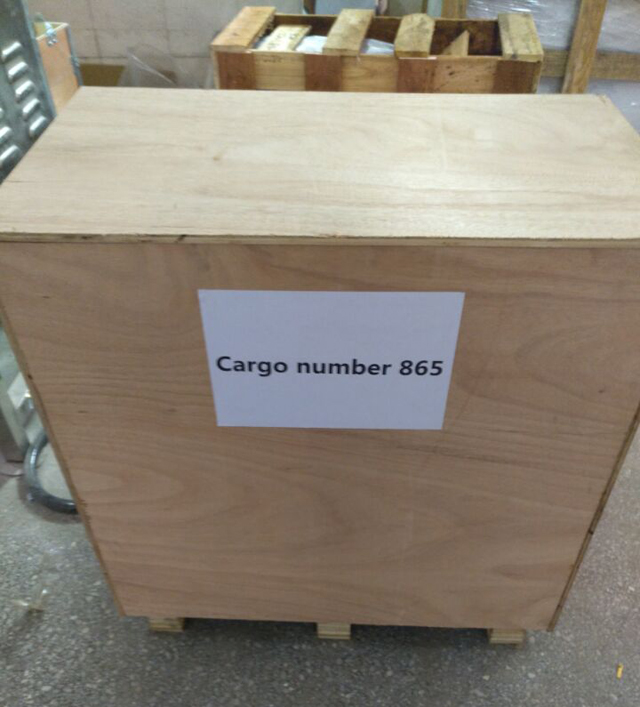
I want to click on air vents, so click(x=26, y=92), click(x=31, y=107), click(x=13, y=76).